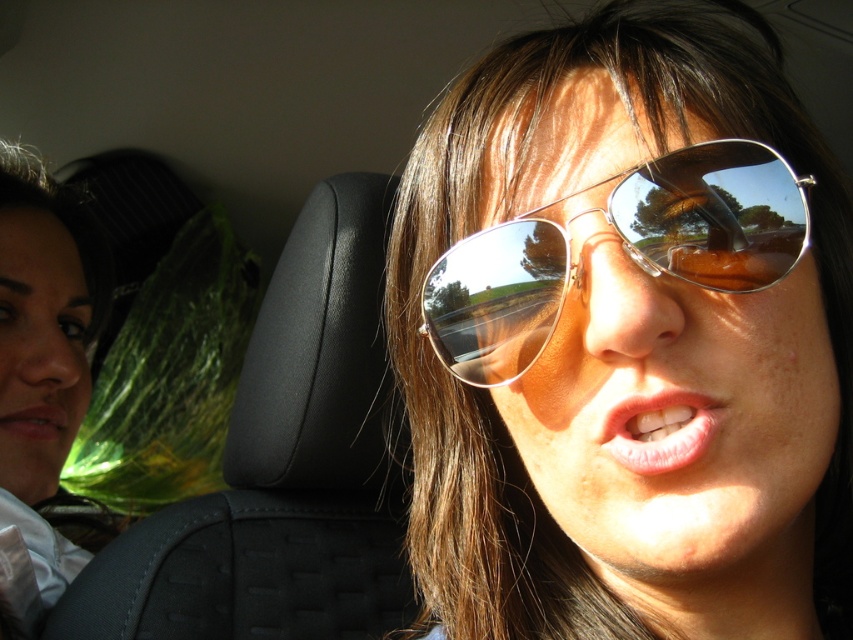
Question: Which of these objects is positioned closest to the matte pink lips at lower left?

Choices:
 (A) pink glossy lips at center
 (B) silver reflective goggles at center
 (C) matte white shirt at left
 (D) shiny silver sunglasses at center

Answer: (C)

Question: Is pink glossy lips at center smaller than matte pink lips at lower left?

Choices:
 (A) yes
 (B) no

Answer: (A)

Question: Which object is positioned farthest from the matte white shirt at left?

Choices:
 (A) matte pink lips at lower left
 (B) shiny silver sunglasses at center
 (C) pink glossy lips at center

Answer: (C)

Question: Which is nearer to the silver reflective goggles at center?

Choices:
 (A) matte pink lips at lower left
 (B) matte white shirt at left

Answer: (A)

Question: Is silver reflective goggles at center behind matte white shirt at left?

Choices:
 (A) no
 (B) yes

Answer: (A)

Question: Does shiny silver sunglasses at center lie in front of matte white shirt at left?

Choices:
 (A) yes
 (B) no

Answer: (A)